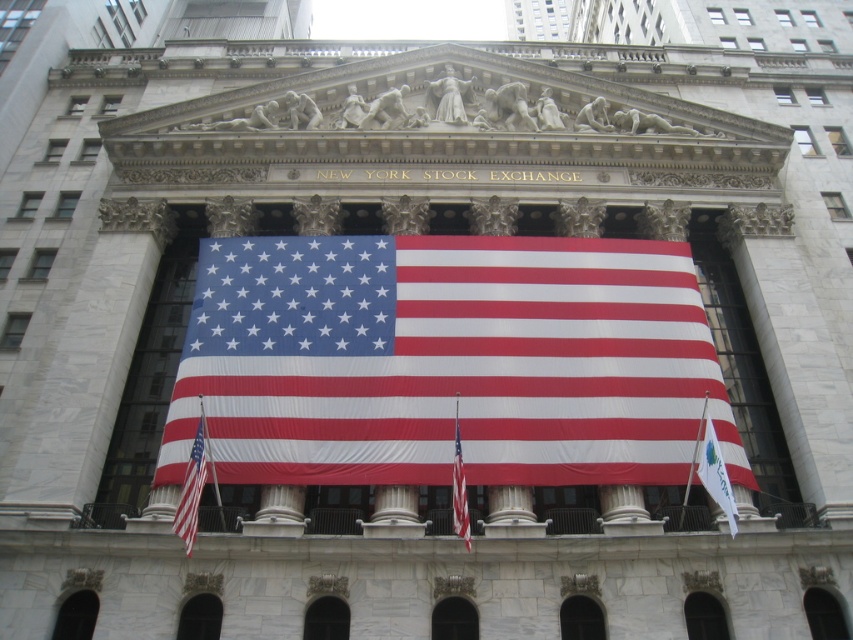
You are standing in front of the New York Stock Exchange building and want to take a photo of the white fabric flag at right. If your camera has a maximum focus range of 50 meters, will you be able to capture the flag clearly?

The distance between the white fabric flag at right and the camera is 48.27 meters, which is within the camera maximum focus range of 50 meters. Therefore, you can capture the flag clearly.

You are a window cleaner standing at the base of the New York Stock Exchange building. You need to clean both the white fabric flag at right and the red fabric flag at center. Given that your ladder can only reach up to 15 meters, can you safely clean both flags without needing a taller ladder?

The white fabric flag at right and red fabric flag at center are 14.26 meters apart from each other. Since the distance between them is less than the ladder maximum reach of 15 meters, the window cleaner can safely clean both flags without needing a taller ladder.